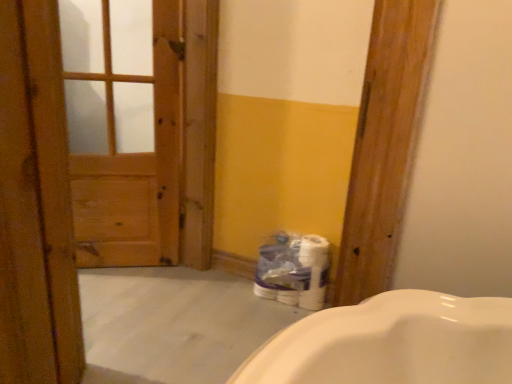
Question: Which is correct: wooden door at left is inside white glossy toilet paper at lower center, or outside of it?

Choices:
 (A) inside
 (B) outside

Answer: (B)

Question: Considering the positions of wooden door at left and white glossy toilet paper at lower center in the image, is wooden door at left bigger or smaller than white glossy toilet paper at lower center?

Choices:
 (A) big
 (B) small

Answer: (A)

Question: Which of these objects is positioned farthest from the wooden door at left?

Choices:
 (A) wooden door at left
 (B) wooden door at left
 (C) white glossy toilet paper at lower center

Answer: (C)

Question: Estimate the real-world distances between objects in this image. Which object is closer to the wooden door at left?

Choices:
 (A) wooden door at left
 (B) wooden door at left
 (C) white glossy toilet paper at lower center

Answer: (B)